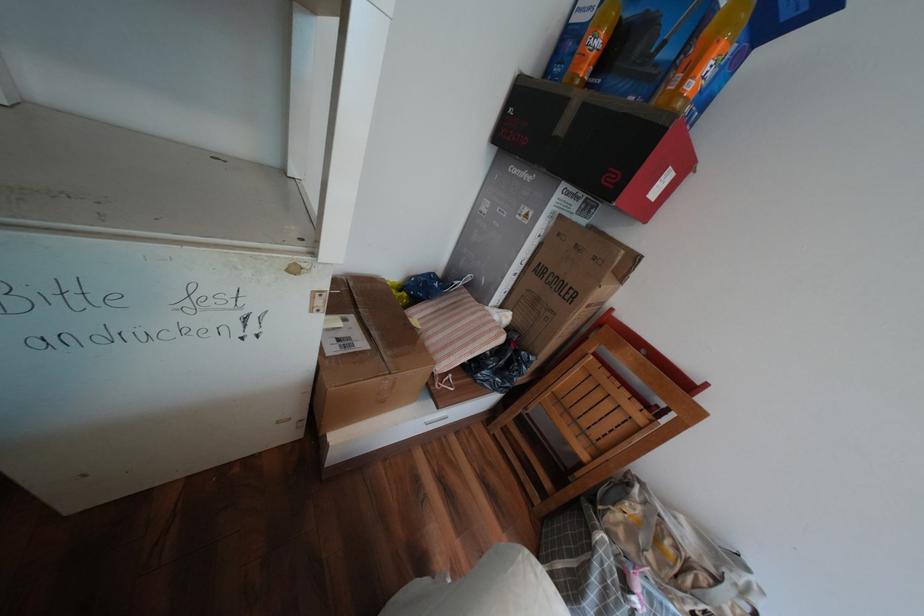
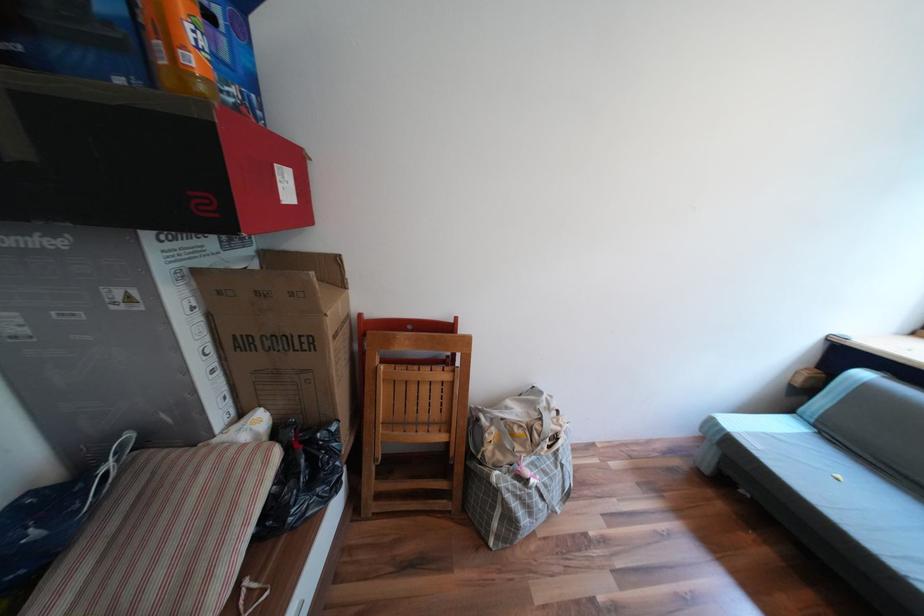
In the second image, find the point that corresponds to (x=533, y=262) in the first image.

(219, 349)